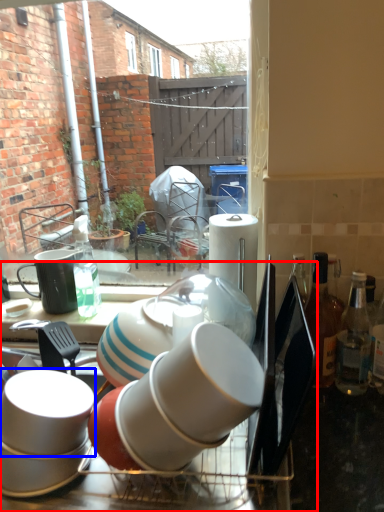
Question: Which point is closer to the camera, dish washer (highlighted by a red box) or coffee cup (highlighted by a blue box)?

Choices:
 (A) dish washer
 (B) coffee cup

Answer: (A)